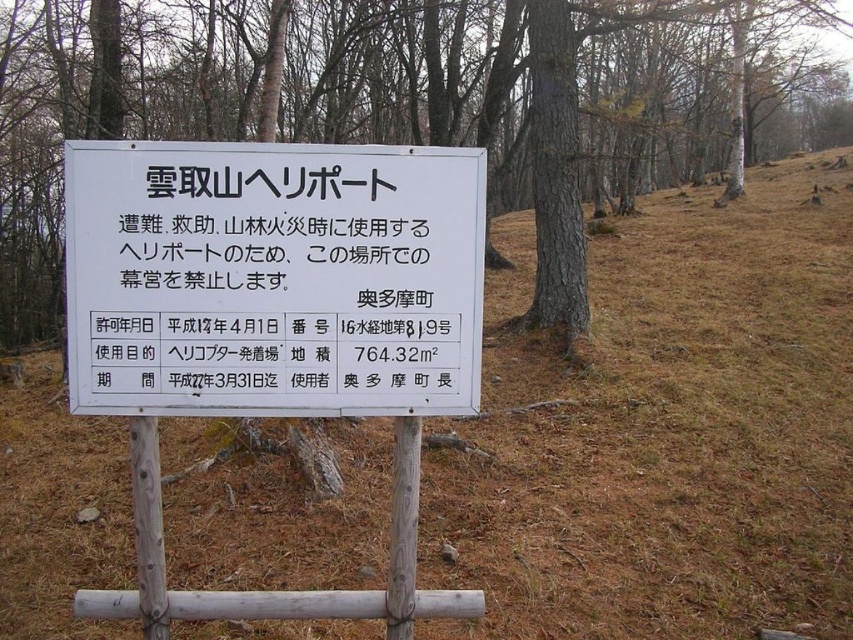
Can you confirm if brown bark tree at center is positioned below white plastic sign at center?

Incorrect, brown bark tree at center is not positioned below white plastic sign at center.

Can you confirm if brown bark tree at center is positioned to the right of white plastic sign at center?

Indeed, brown bark tree at center is positioned on the right side of white plastic sign at center.

In order to click on brown bark tree at center in this screenshot , I will do `click(416, 106)`.